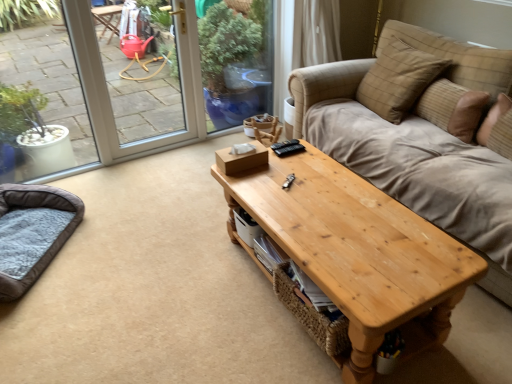
Question: From a real-world perspective, is natural wood coffee table at center physically located above or below dark brown plush cat bed at lower left?

Choices:
 (A) below
 (B) above

Answer: (B)

Question: Looking at their shapes, would you say natural wood coffee table at center is wider or thinner than dark brown plush cat bed at lower left?

Choices:
 (A) wide
 (B) thin

Answer: (A)

Question: Which is nearer to the dark brown plush cat bed at lower left?

Choices:
 (A) plaid fabric pillow at upper right, the second pillow from the right
 (B) brown textured pillow at upper right, the first pillow from the right
 (C) natural wood coffee table at center

Answer: (C)

Question: Considering the real-world distances, which object is closest to the natural wood coffee table at center?

Choices:
 (A) dark brown plush cat bed at lower left
 (B) plaid fabric pillow at upper right, which is the first pillow in left-to-right order
 (C) brown textured pillow at upper right, the first pillow from the right

Answer: (C)